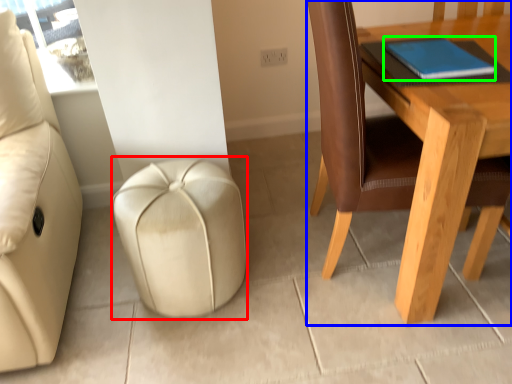
Question: Estimate the real-world distances between objects in this image. Which object is closer to stool (highlighted by a red box), table (highlighted by a blue box) or notebook (highlighted by a green box)?

Choices:
 (A) table
 (B) notebook

Answer: (A)